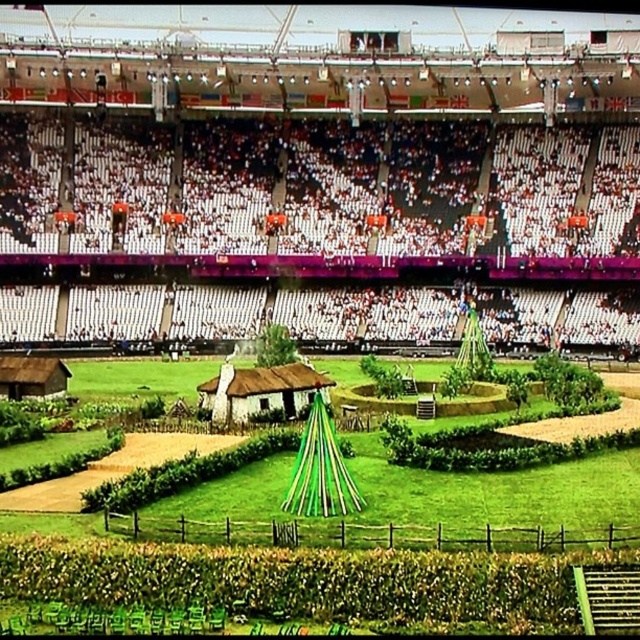
Question: Which point is closer to the camera?

Choices:
 (A) (292, 417)
 (B) (44, 364)

Answer: (A)

Question: Does rustic thatched hut at center have a larger size compared to brown wooden hut at lower left?

Choices:
 (A) no
 (B) yes

Answer: (B)

Question: Is rustic thatched hut at center above brown wooden hut at lower left?

Choices:
 (A) no
 (B) yes

Answer: (A)

Question: Among these objects, which one is farthest from the camera?

Choices:
 (A) rustic thatched hut at center
 (B) brown wooden hut at lower left

Answer: (B)

Question: Does rustic thatched hut at center have a lesser width compared to brown wooden hut at lower left?

Choices:
 (A) yes
 (B) no

Answer: (A)